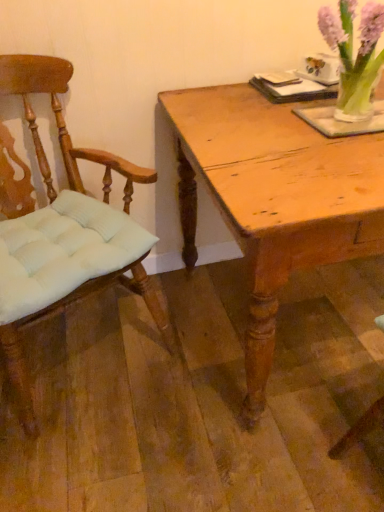
Question: Could translucent glass vase at upper right be considered to be inside light brown wooden table at center?

Choices:
 (A) yes
 (B) no

Answer: (B)

Question: From the image's perspective, is light brown wooden table at center beneath translucent glass vase at upper right?

Choices:
 (A) no
 (B) yes

Answer: (B)

Question: From the image's perspective, does light brown wooden table at center appear higher than translucent glass vase at upper right?

Choices:
 (A) yes
 (B) no

Answer: (B)

Question: From a real-world perspective, is light brown wooden table at center physically above translucent glass vase at upper right?

Choices:
 (A) no
 (B) yes

Answer: (A)

Question: Would you say light brown wooden table at center is outside translucent glass vase at upper right?

Choices:
 (A) yes
 (B) no

Answer: (A)

Question: Considering the positions of light brown wooden table at center and light brown wood chair at left in the image, is light brown wooden table at center taller or shorter than light brown wood chair at left?

Choices:
 (A) short
 (B) tall

Answer: (A)

Question: In the image, is light brown wooden table at center positioned in front of or behind light brown wood chair at left?

Choices:
 (A) front
 (B) behind

Answer: (B)

Question: From the image's perspective, is light brown wooden table at center above or below light brown wood chair at left?

Choices:
 (A) below
 (B) above

Answer: (B)

Question: In terms of size, does light brown wooden table at center appear bigger or smaller than light brown wood chair at left?

Choices:
 (A) small
 (B) big

Answer: (B)

Question: Is point (62, 244) positioned closer to the camera than point (362, 117)?

Choices:
 (A) farther
 (B) closer

Answer: (A)

Question: Considering the positions of light brown wood chair at left and translucent glass vase at upper right in the image, is light brown wood chair at left taller or shorter than translucent glass vase at upper right?

Choices:
 (A) tall
 (B) short

Answer: (A)

Question: Is light brown wood chair at left spatially inside translucent glass vase at upper right, or outside of it?

Choices:
 (A) outside
 (B) inside

Answer: (A)

Question: Would you say light brown wood chair at left is to the left or to the right of translucent glass vase at upper right in the picture?

Choices:
 (A) left
 (B) right

Answer: (A)

Question: Is light brown wooden table at center to the left or to the right of translucent glass vase at upper right in the image?

Choices:
 (A) left
 (B) right

Answer: (B)

Question: Is point (225, 157) closer or farther from the camera than point (347, 27)?

Choices:
 (A) farther
 (B) closer

Answer: (B)